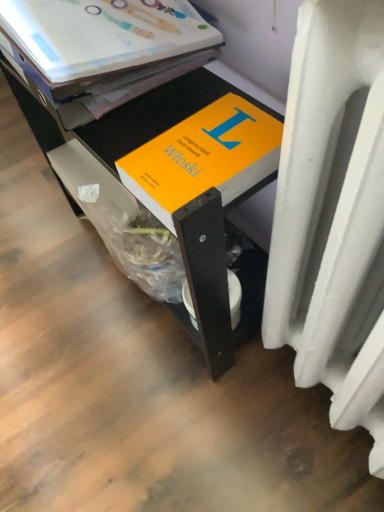
Question: Based on their positions, is orange matte book at upper center located to the left or right of orange matte book at center?

Choices:
 (A) left
 (B) right

Answer: (A)

Question: Looking at the image, does orange matte book at upper center seem bigger or smaller compared to orange matte book at center?

Choices:
 (A) small
 (B) big

Answer: (A)

Question: Considering the real-world distances, which object is farthest from the white plastic heater at lower right?

Choices:
 (A) orange matte book at center
 (B) orange matte book at center
 (C) orange matte book at upper center

Answer: (C)

Question: Which is nearer to the orange matte book at center?

Choices:
 (A) orange matte book at upper center
 (B) white plastic heater at lower right
 (C) orange matte book at center

Answer: (C)